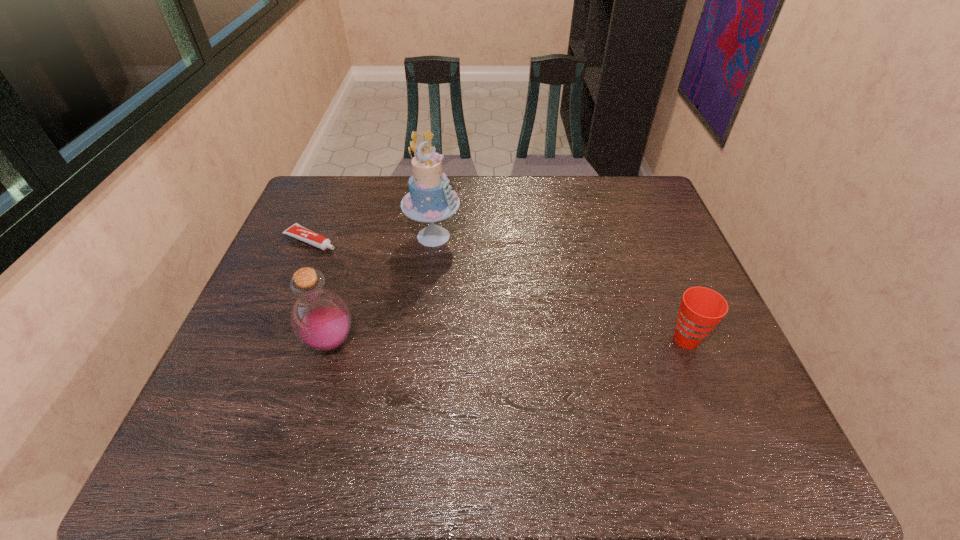
Identify the location of vacant point located with a ladder on the side of the tallest object. The image size is (960, 540). [x=491, y=295].

Where is `vacant space located at the nozzle of the toothpaste`? The height and width of the screenshot is (540, 960). vacant space located at the nozzle of the toothpaste is located at coordinates (375, 266).

Where is `vacant space located 0.240m at the nozzle of the toothpaste`? vacant space located 0.240m at the nozzle of the toothpaste is located at coordinates (398, 277).

The height and width of the screenshot is (540, 960). Identify the location of vacant space located at the nozzle of the toothpaste. (441, 296).

The image size is (960, 540). What are the coordinates of `object that is at the left edge` in the screenshot? It's located at (297, 231).

The width and height of the screenshot is (960, 540). What are the coordinates of `object that is at the right edge` in the screenshot? It's located at pos(701,309).

At what (x,y) coordinates should I click in order to perform the action: click on vacant space at the far edge of the desktop. Please return your answer as a coordinate pair (x, y). The image size is (960, 540). Looking at the image, I should click on (549, 202).

This screenshot has height=540, width=960. I want to click on free space at the near edge of the desktop, so click(x=400, y=394).

Identify the location of vacant area at the left edge. (272, 301).

The image size is (960, 540). I want to click on vacant area at the near left corner, so click(236, 402).